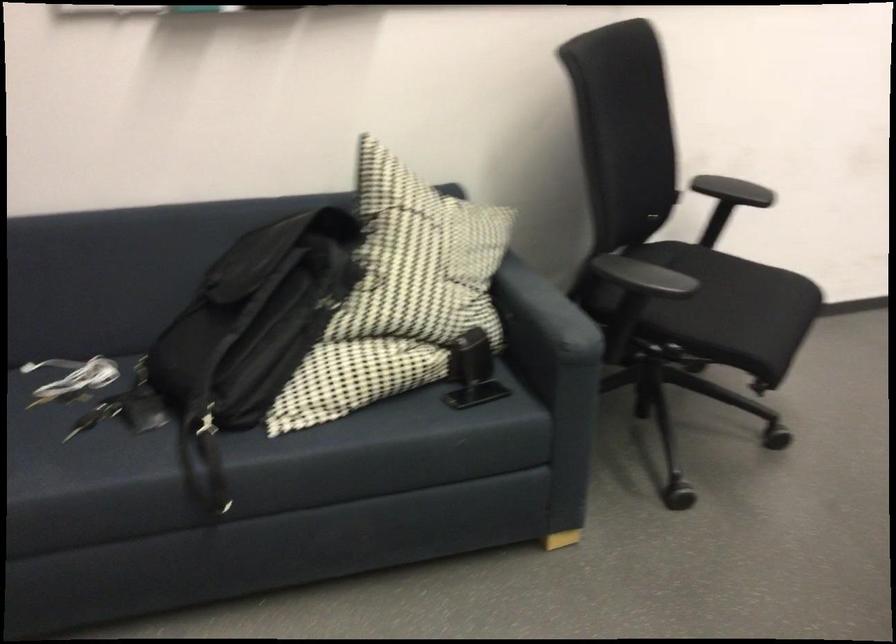
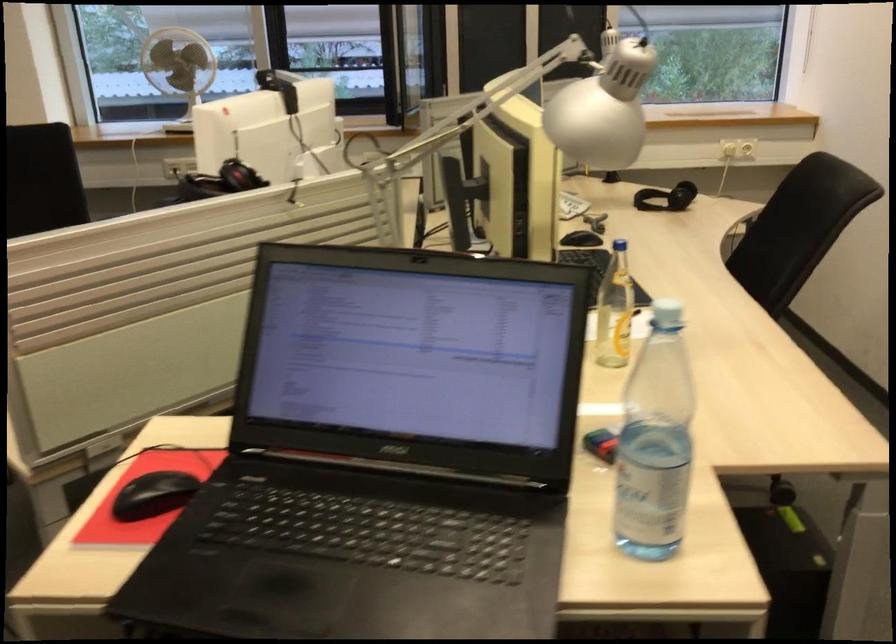
Question: The camera is either moving clockwise (left) or counter-clockwise (right) around the object. The first image is from the beginning of the video and the second image is from the end. Is the camera moving left or right when shooting the video?

Choices:
 (A) Left
 (B) Right

Answer: (A)